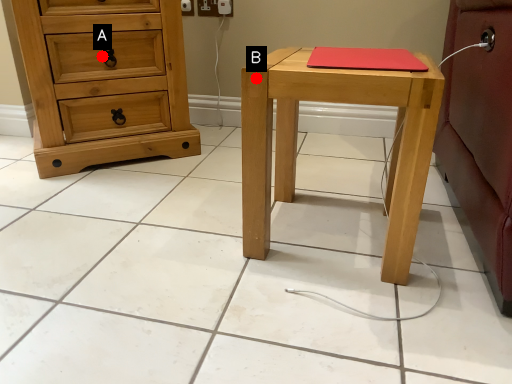
Question: Two points are circled on the image, labeled by A and B beside each circle. Which point is closer to the camera?

Choices:
 (A) A is closer
 (B) B is closer

Answer: (B)